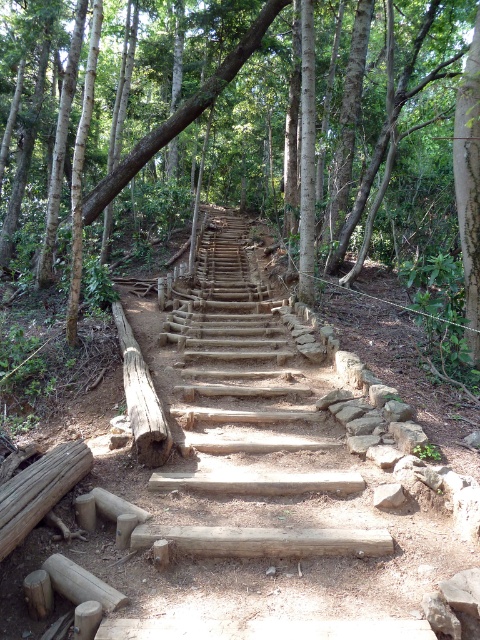
Question: Does natural wood stairs at center have a lesser width compared to brown rough log at lower left?

Choices:
 (A) yes
 (B) no

Answer: (B)

Question: Is smooth brown log at center below natural wood stairs at center?

Choices:
 (A) yes
 (B) no

Answer: (B)

Question: Among these objects, which one is farthest from the camera?

Choices:
 (A) natural wood stairs at center
 (B) brown rough log at lower left
 (C) brown rough log at center

Answer: (C)

Question: Which object appears closest to the camera in this image?

Choices:
 (A) smooth brown log at center
 (B) brown rough log at center

Answer: (B)

Question: Among these objects, which one is farthest from the camera?

Choices:
 (A) brown rough log at lower left
 (B) natural wood stairs at center
 (C) brown rough log at center

Answer: (C)

Question: Is brown rough log at lower left to the left of brown rough log at center from the viewer's perspective?

Choices:
 (A) yes
 (B) no

Answer: (B)